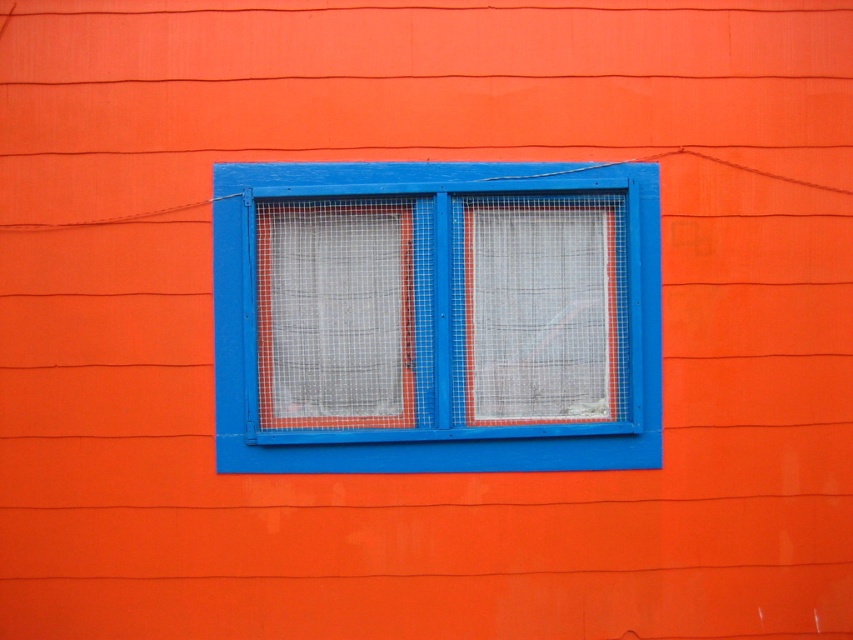
Is blue painted wood window at center positioned before white mesh screen at center?

Yes, blue painted wood window at center is closer to the viewer.

Which is below, blue painted wood window at center or white mesh screen at center?

Positioned lower is blue painted wood window at center.

Who is more forward, (573,314) or (480,355)?

Point (480,355)

Identify the location of blue painted wood window at center. This screenshot has width=853, height=640. (436, 317).

Can you confirm if metal mesh screen at center is positioned above white mesh screen at center?

No, metal mesh screen at center is not above white mesh screen at center.

Who is more forward, (357, 344) or (563, 371)?

Point (357, 344)

Find the location of a particular element. metal mesh screen at center is located at coordinates 335,314.

Is blue painted wood window at center closer to camera compared to metal mesh screen at center?

Yes, blue painted wood window at center is in front of metal mesh screen at center.

Can you confirm if blue painted wood window at center is smaller than metal mesh screen at center?

No, blue painted wood window at center is not smaller than metal mesh screen at center.

Find the location of `blue painted wood window at center`. blue painted wood window at center is located at coordinates (436, 317).